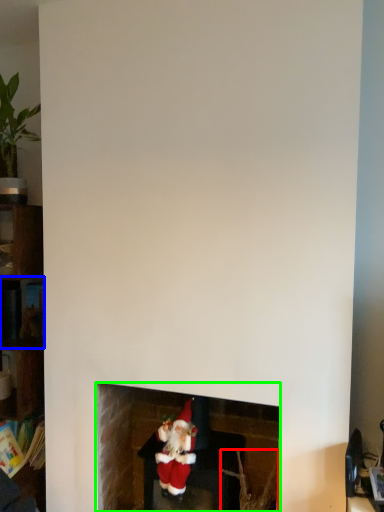
Question: Based on their relative distances, which object is nearer to plant (highlighted by a red box)? Choose from shelf (highlighted by a blue box) and fireplace (highlighted by a green box).

Choices:
 (A) shelf
 (B) fireplace

Answer: (B)